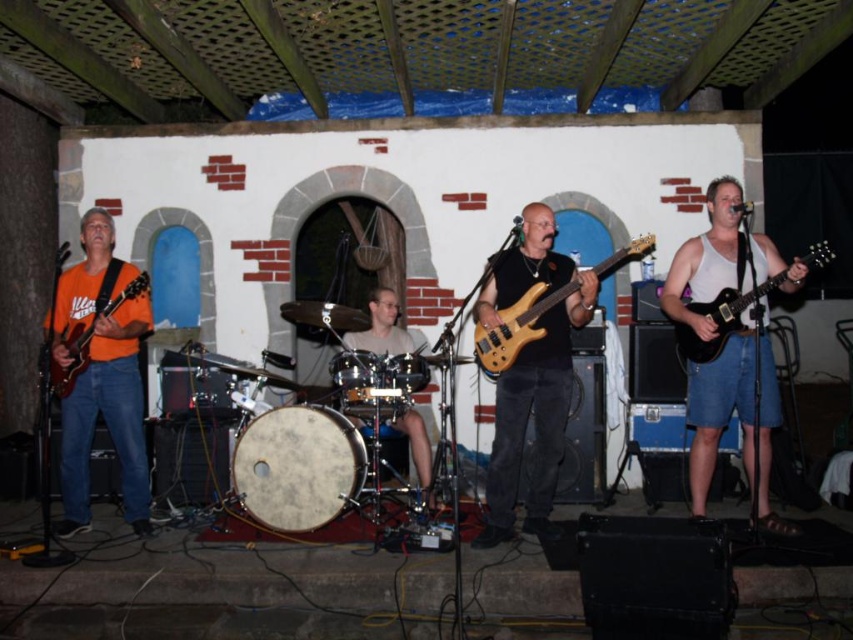
Based on the scene description, can you determine the vertical position of the white textured drum at center relative to the wooden electric bass at center?

The white textured drum at center is located below the wooden electric electric bass at center.

You are a photographer positioned at the origin point of the coordinate system. The band members are located at different points. The leftmost member is at point A, the center member is at point B, and the rightmost member is at point C. Given that the white tank top at right is represented by point C at coordinates (721, 260), can you determine the coordinates of the other band members?

The coordinates of the leftmost member at point A and the center member at point B are not provided in the given information. Only the coordinates of the white tank top at right at point C are specified as (721, 260).